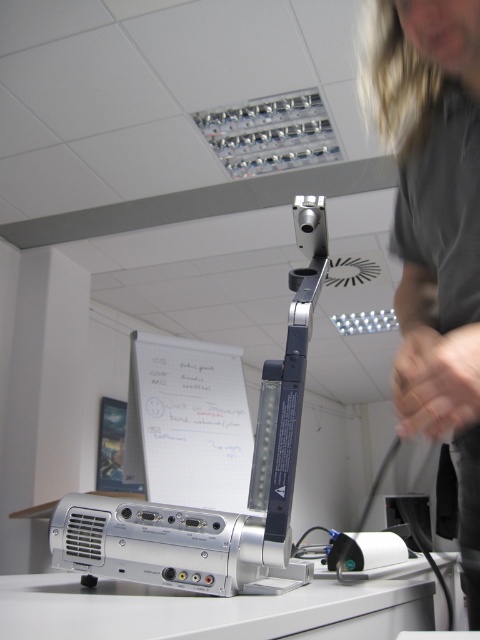
Question: In this image, where is gray fabric shirt at upper right located relative to silver metallic projector at lower center?

Choices:
 (A) below
 (B) above

Answer: (B)

Question: Is silver metallic projector at lower center closer to camera compared to silver metallic table at lower center?

Choices:
 (A) no
 (B) yes

Answer: (A)

Question: Can you confirm if gray fabric shirt at upper right is wider than silver metallic projector at lower center?

Choices:
 (A) no
 (B) yes

Answer: (A)

Question: Which object is positioned farthest from the silver metallic table at lower center?

Choices:
 (A) silver metallic projector at lower center
 (B) gray fabric shirt at upper right

Answer: (B)

Question: Which of these objects is positioned closest to the gray fabric shirt at upper right?

Choices:
 (A) silver metallic projector at lower center
 (B) silver metallic table at lower center

Answer: (A)

Question: Which point is farther from the camera taking this photo?

Choices:
 (A) (442, 392)
 (B) (268, 592)
 (C) (61, 624)

Answer: (B)